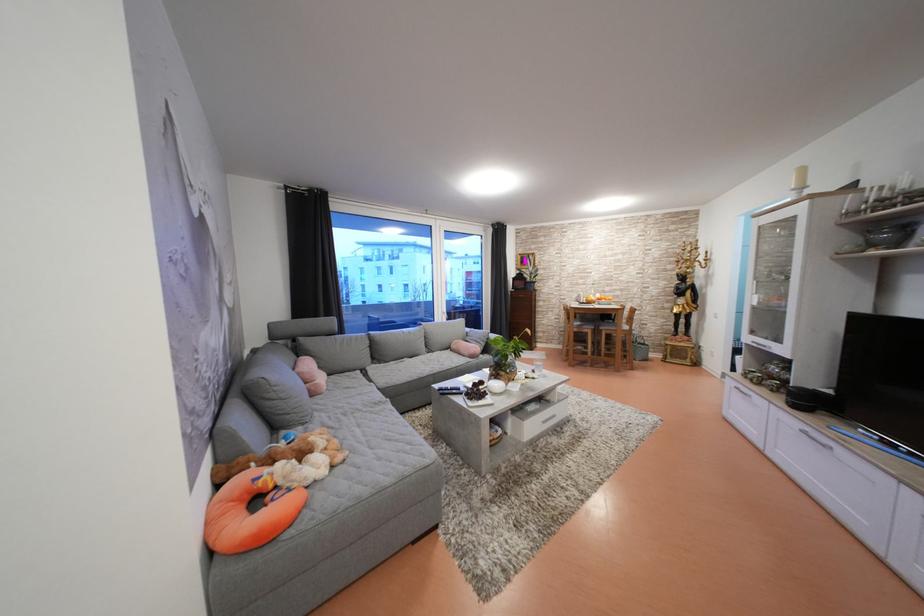
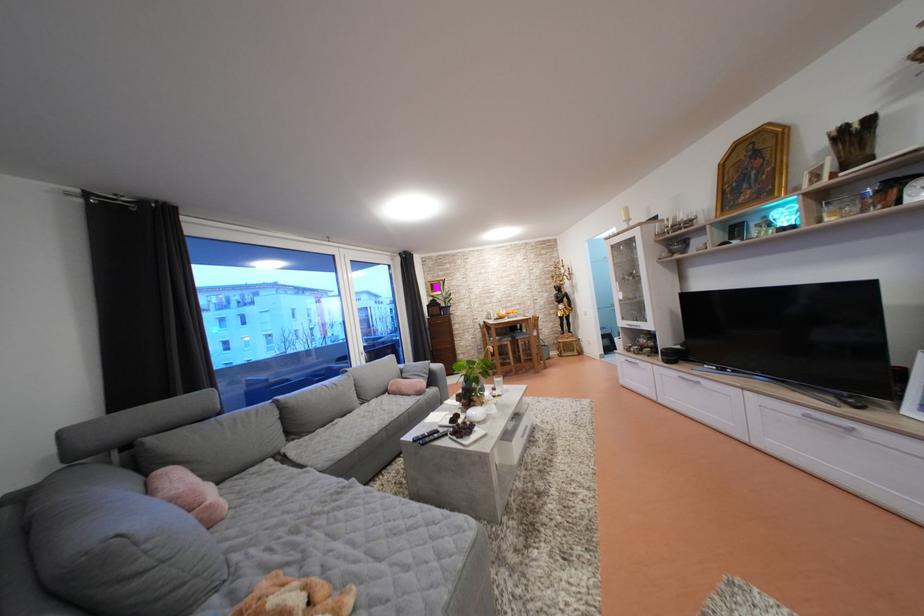
Find the pixel in the second image that matches [307,379] in the first image.

(180, 505)